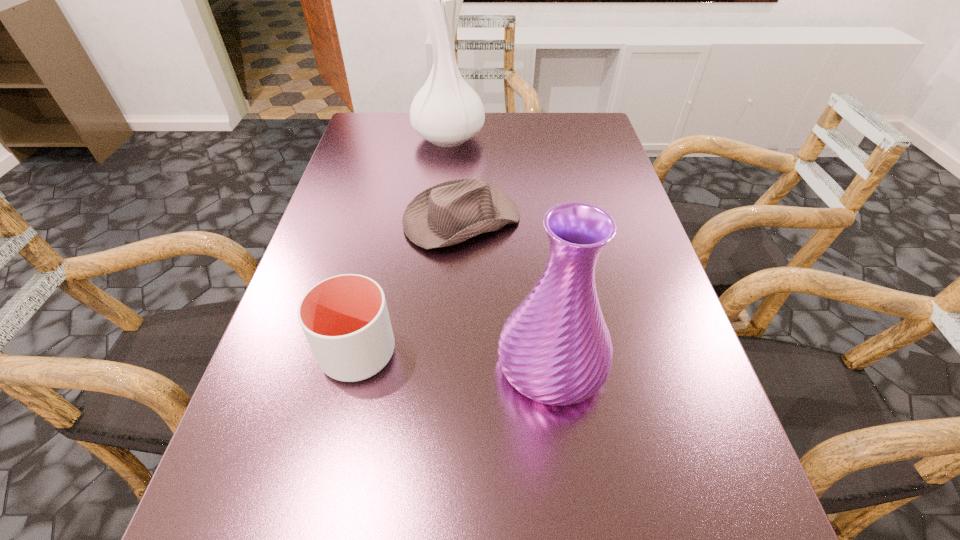
Locate an element on the screen. The height and width of the screenshot is (540, 960). vacant area in the image that satisfies the following two spatial constraints: 1. on the front side of the shorter vase; 2. on the right side of the farthest object is located at coordinates (426, 363).

Identify the location of vacant space that satisfies the following two spatial constraints: 1. on the front side of the third shortest object; 2. on the left side of the farther vase. (426, 363).

Where is `free location that satisfies the following two spatial constraints: 1. on the front side of the third nearest object; 2. on the left side of the shorter vase`? This screenshot has height=540, width=960. free location that satisfies the following two spatial constraints: 1. on the front side of the third nearest object; 2. on the left side of the shorter vase is located at coordinates (455, 363).